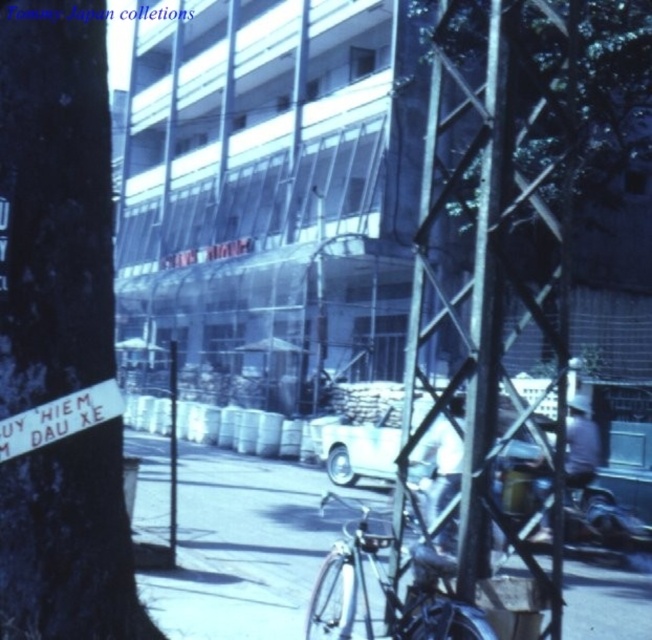
Between smooth asphalt pavement at center and white matte car at center, which one has less height?

Standing shorter between the two is smooth asphalt pavement at center.

Which is more to the left, smooth asphalt pavement at center or white matte car at center?

From the viewer's perspective, smooth asphalt pavement at center appears more on the left side.

Between point (546, 557) and point (393, 404), which one is positioned in front?

Positioned in front is point (546, 557).

The height and width of the screenshot is (640, 652). Identify the location of smooth asphalt pavement at center. (243, 547).

From the picture: Which is below, green bark tree at left or smooth asphalt pavement at center?

Positioned lower is smooth asphalt pavement at center.

Does green bark tree at left have a lesser width compared to smooth asphalt pavement at center?

Indeed, green bark tree at left has a lesser width compared to smooth asphalt pavement at center.

Is point (23, 173) positioned before point (250, 548)?

Yes, it is in front of point (250, 548).

The width and height of the screenshot is (652, 640). I want to click on green bark tree at left, so click(53, 200).

Which of these two, green bark tree at left or white matte car at center, stands shorter?

white matte car at center is shorter.

Between point (35, 381) and point (378, 460), which one is positioned in front?

Point (35, 381) is in front.

The image size is (652, 640). Identify the location of green bark tree at left. pyautogui.click(x=53, y=200).